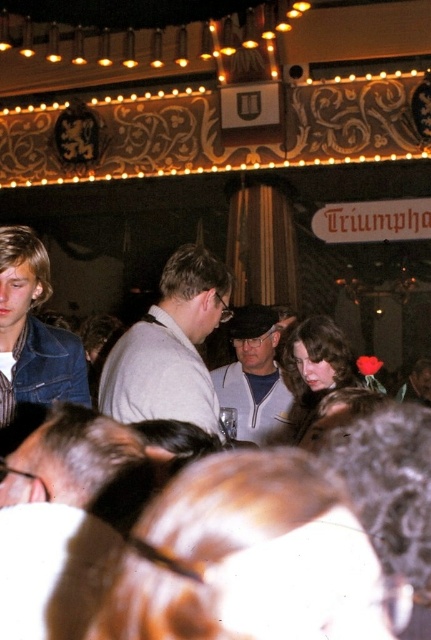
You are at a social gathering and see two gray fabric items at the center of the image. Which one is taller, the gray fabric shirt at center or the gray fabric jacket at center?

The gray fabric shirt at center is much taller than the gray fabric jacket at center.

You are at the event and want to greet the person wearing the faded denim jacket at lower right without blocking the view of the person in the gray fabric shirt at center. Is this possible?

The gray fabric shirt at center is in front of the faded denim jacket at lower right, so you can move around the gray fabric shirt at center to greet the faded denim jacket at lower right without blocking their view.